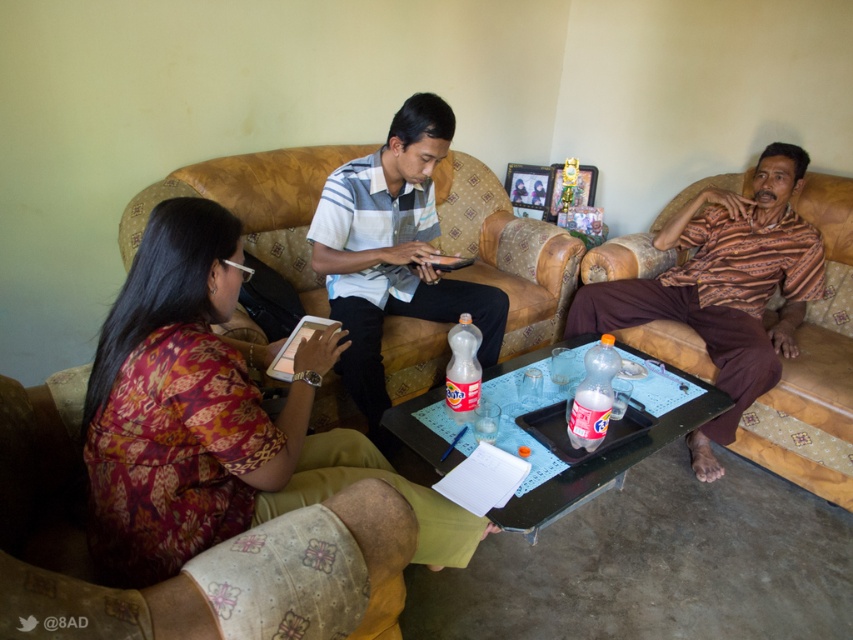
Question: Considering the real-world distances, which object is closest to the leather couch at center?

Choices:
 (A) batik fabric tablet at center
 (B) batik-patterned shirt at right
 (C) striped cotton shirt at center

Answer: (B)

Question: Which object appears closest to the camera in this image?

Choices:
 (A) batik fabric tablet at center
 (B) striped cotton shirt at center
 (C) batik-patterned shirt at right
 (D) leather couch at center

Answer: (A)

Question: Which point appears farthest from the camera in this image?

Choices:
 (A) (518, 280)
 (B) (0, 508)
 (C) (732, 406)

Answer: (A)

Question: Does batik-patterned shirt at right come in front of striped cotton shirt at center?

Choices:
 (A) yes
 (B) no

Answer: (B)

Question: Where is batik-patterned shirt at right located in relation to striped cotton shirt at center in the image?

Choices:
 (A) left
 (B) right

Answer: (B)

Question: Can you confirm if leather couch at center is wider than striped cotton shirt at center?

Choices:
 (A) no
 (B) yes

Answer: (A)